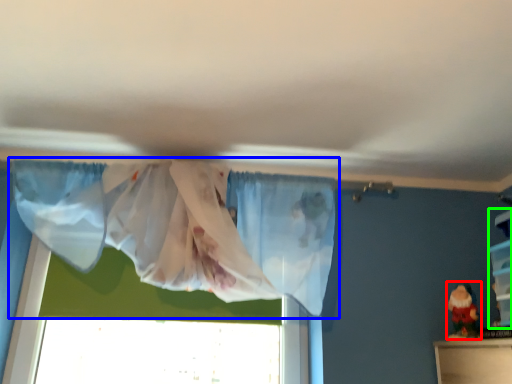
Question: Considering the real-world distances, which object is closest to toy (highlighted by a red box)? curtain (highlighted by a blue box) or shelf (highlighted by a green box).

Choices:
 (A) curtain
 (B) shelf

Answer: (B)